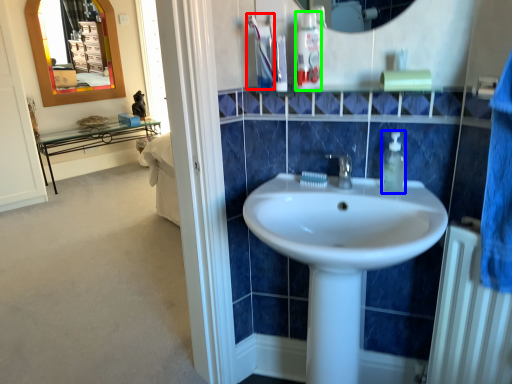
Question: Based on their relative distances, which object is farther from toothpaste (highlighted by a red box)? Choose from soap dispenser (highlighted by a blue box) and mouthwash (highlighted by a green box).

Choices:
 (A) soap dispenser
 (B) mouthwash

Answer: (A)